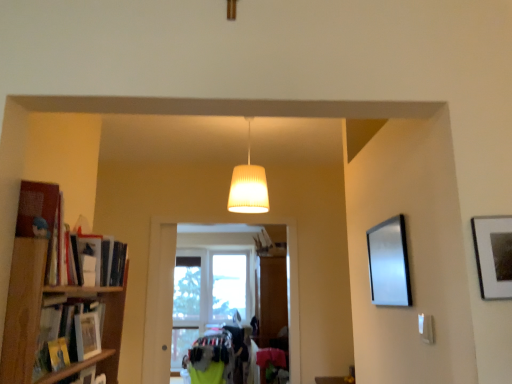
Question: In terms of size, does wooden bookshelf at left appear bigger or smaller than white ribbed lampshade at center?

Choices:
 (A) small
 (B) big

Answer: (B)

Question: Relative to white ribbed lampshade at center, is wooden bookshelf at left in front or behind?

Choices:
 (A) front
 (B) behind

Answer: (A)

Question: Which object is the farthest from the hardcover book at left, positioned as the second book in top-to-bottom order?

Choices:
 (A) silver metallic picture frame at right
 (B) white ribbed lampshade at center
 (C) transparent glass window at center
 (D) matte black bookshelf at left, marked as the 3th book in a back-to-front arrangement
 (E) wooden photo frame at left, the 3th book positioned from the top

Answer: (C)

Question: Which of these objects is positioned closest to the white ribbed lampshade at center?

Choices:
 (A) silver metallic picture frame at right
 (B) matte black bookshelf at left, marked as the 3th book in a back-to-front arrangement
 (C) wooden photo frame at left, the 3th book positioned from the top
 (D) hardcover book at left, acting as the 3th book starting from the front
 (E) wooden bookshelf at left

Answer: (D)